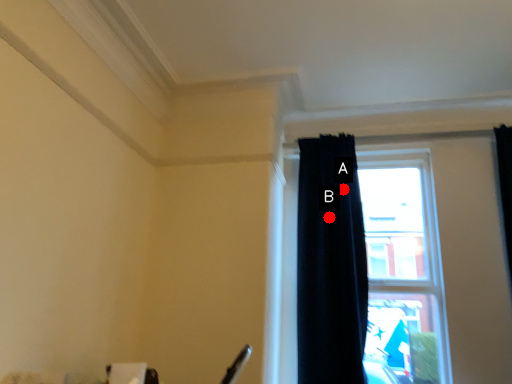
Question: Two points are circled on the image, labeled by A and B beside each circle. Which of the following is the closest to the observer?

Choices:
 (A) A is closer
 (B) B is closer

Answer: (B)